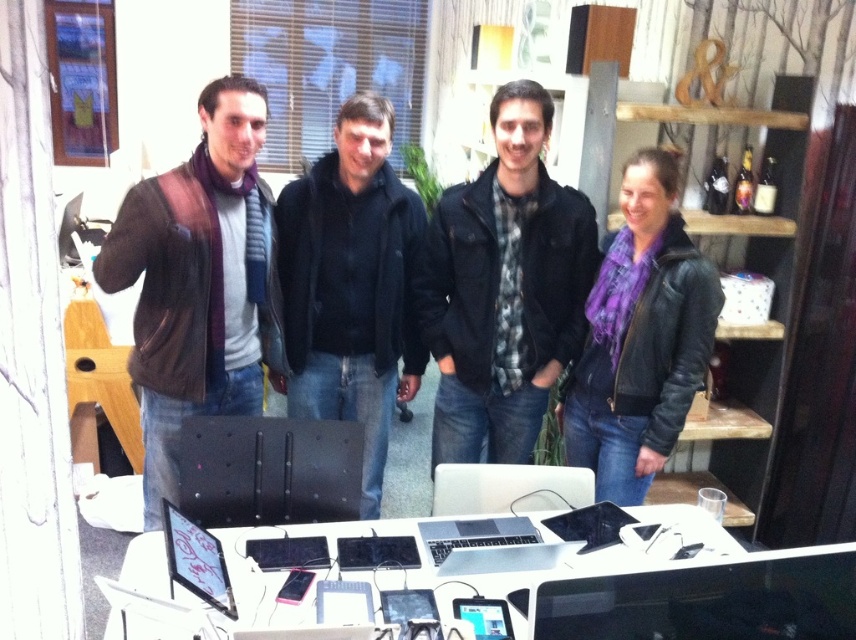
Does plaid fabric shirt at center have a greater width compared to black matte jacket at center?

No, plaid fabric shirt at center is not wider than black matte jacket at center.

Describe the element at coordinates (504, 289) in the screenshot. This screenshot has height=640, width=856. I see `plaid fabric shirt at center` at that location.

I want to click on plaid fabric shirt at center, so click(x=504, y=289).

Is plaid fabric shirt at center smaller than white glossy table at lower center?

Actually, plaid fabric shirt at center might be larger than white glossy table at lower center.

From the picture: Who is more forward, [486,166] or [522,618]?

Point [522,618] is in front.

Where is `plaid fabric shirt at center`? The height and width of the screenshot is (640, 856). plaid fabric shirt at center is located at coordinates (504, 289).

Can you confirm if white glossy table at lower center is positioned above purple leather jacket at right?

No.

Which is behind, point (232, 589) or point (635, 401)?

Positioned behind is point (635, 401).

Identify the location of white glossy table at lower center. The height and width of the screenshot is (640, 856). (389, 570).